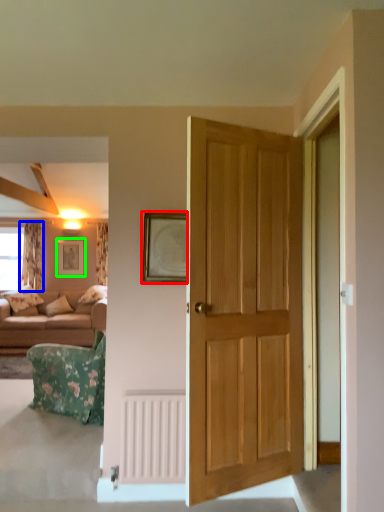
Question: Considering the real-world distances, which object is closest to picture frame (highlighted by a red box)? curtain (highlighted by a blue box) or picture frame (highlighted by a green box).

Choices:
 (A) curtain
 (B) picture frame

Answer: (A)